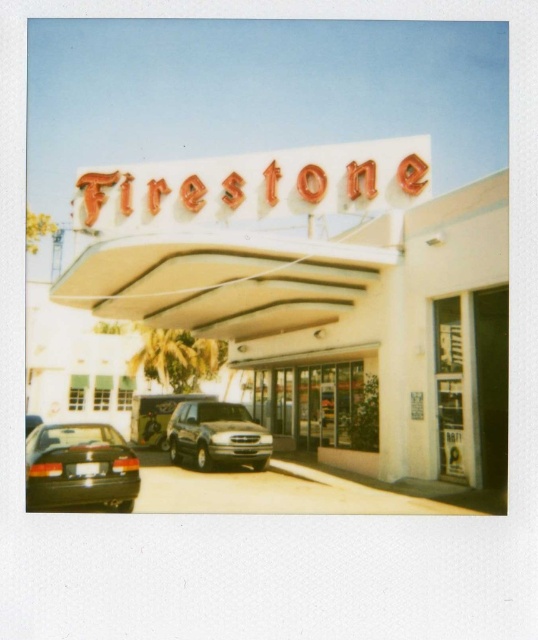
Consider the image. You are a customer standing in front of the Firestone tire store. You notice the white matte sign at upper center and the black matte car at lower left. Which object is taller?

The white matte sign at upper center is taller than the black matte car at lower left.

You are standing in front of the vintage Firestone tire store and want to take a photo of both the point at coordinates point (371, 189) and point (38, 442). Which point will appear closer to the bottom of the photo?

Point (38, 442) will appear closer to the bottom of the photo because it is closer to the camera than point (371, 189).